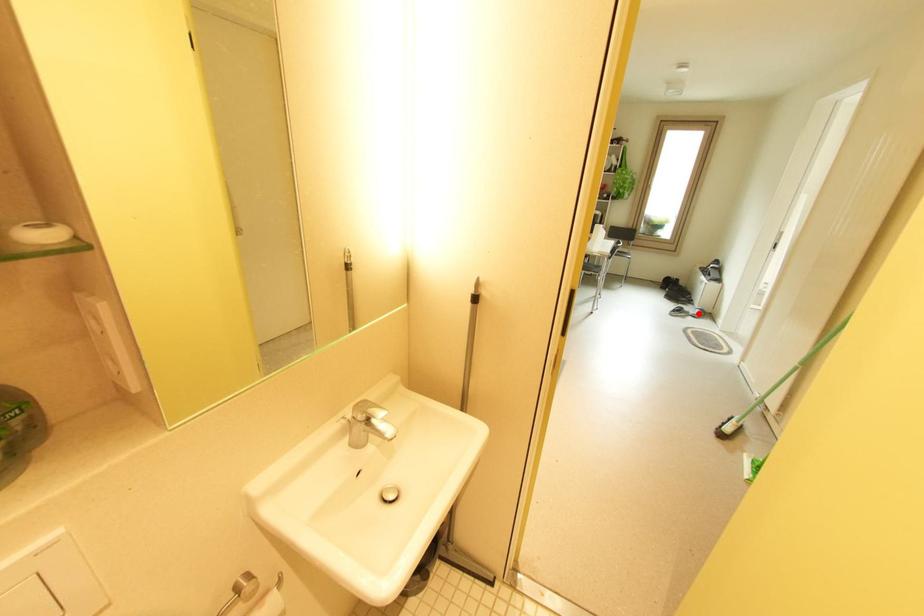
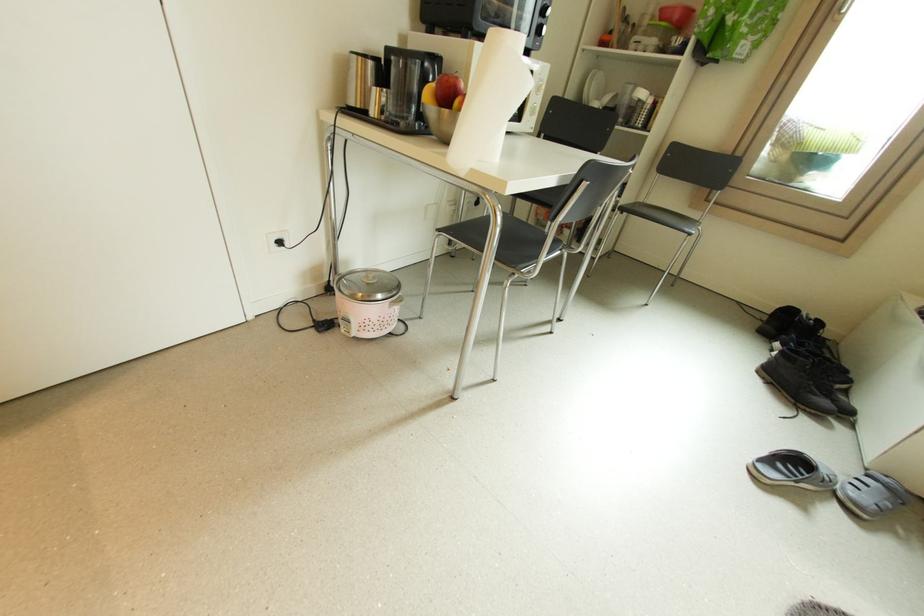
The point at the highlighted location is marked in the first image. Where is the corresponding point in the second image?

(858, 495)